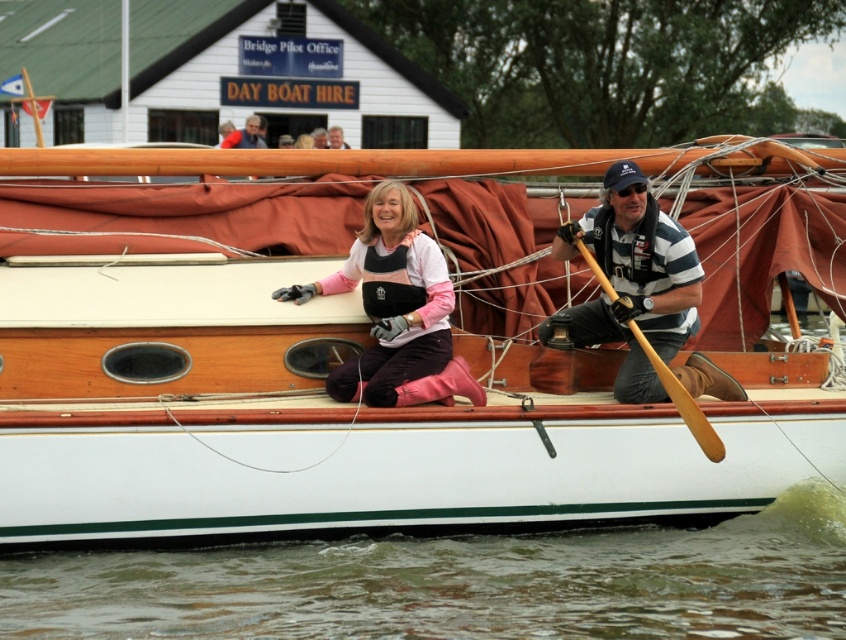
You are a safety inspector checking the boat. You notice the smooth brown leather jacket at upper center and the white wood boat at center. Which object is taller?

The white wood boat at center is taller than the smooth brown leather jacket at upper center according to the description.

You are standing on the dock and see the white wood boat at center and the pink rubber boots at center in the water. Which object is closer to you?

The white wood boat at center is closer to you than the pink rubber boots at center because the pink rubber boots at center is behind the white wood boat at center.

You are standing at the point labeled as point [508,372] and want to take a photo of the boat with the two people. If your camera can focus up to 40 feet away, will you be able to capture the boat clearly?

The point [508,372] and camera are 42.74 feet apart from each other. Since the camera can only focus up to 40 feet, the boat will be out of focus and unclear.